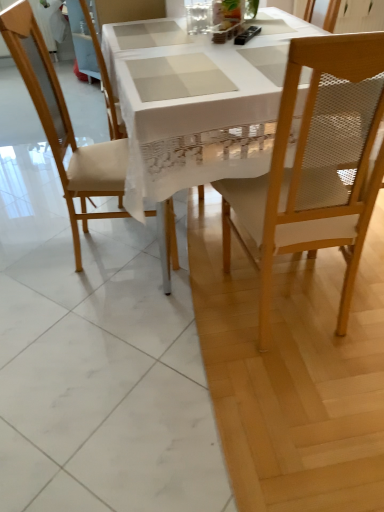
Find the location of a particular element. free space in front of light wood mesh chair at right, which is the first chair in right-to-left order is located at coordinates (293, 391).